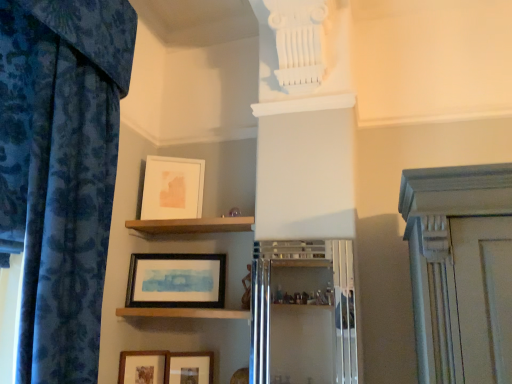
Question: From a real-world perspective, is wooden matte picture frame at lower left, the 4th picture frame when ordered from top to bottom, physically above matte white picture frame at upper center, which is the 1th picture frame from top to bottom?

Choices:
 (A) no
 (B) yes

Answer: (A)

Question: Can you confirm if wooden matte picture frame at lower left, the first picture frame when ordered from bottom to top, is thinner than matte white picture frame at upper center, which is the 1th picture frame from top to bottom?

Choices:
 (A) yes
 (B) no

Answer: (B)

Question: Is wooden matte picture frame at lower left, the first picture frame when ordered from bottom to top, next to matte white picture frame at upper center, which is the 1th picture frame from top to bottom?

Choices:
 (A) yes
 (B) no

Answer: (B)

Question: Is wooden matte picture frame at lower left, the 4th picture frame when ordered from top to bottom, not inside matte white picture frame at upper center, which is the 1th picture frame from top to bottom?

Choices:
 (A) no
 (B) yes

Answer: (B)

Question: Is wooden matte picture frame at lower left, the 4th picture frame when ordered from top to bottom, facing towards matte white picture frame at upper center, the fourth picture frame positioned from the bottom?

Choices:
 (A) no
 (B) yes

Answer: (A)

Question: Is the depth of wooden matte picture frame at lower left, the first picture frame when ordered from bottom to top, less than that of matte white picture frame at upper center, the fourth picture frame positioned from the bottom?

Choices:
 (A) no
 (B) yes

Answer: (B)

Question: Does brown wooden shelf at upper center, which is counted as the 2th shelf, starting from the bottom, have a lesser width compared to wooden framed picture at lower center, acting as the second picture frame starting from the bottom?

Choices:
 (A) no
 (B) yes

Answer: (A)

Question: From a real-world perspective, is brown wooden shelf at upper center, which is counted as the 2th shelf, starting from the bottom, located beneath wooden framed picture at lower center, positioned as the 3th picture frame in top-to-bottom order?

Choices:
 (A) no
 (B) yes

Answer: (A)

Question: Considering the relative sizes of brown wooden shelf at upper center, which is counted as the 2th shelf, starting from the bottom, and wooden framed picture at lower center, positioned as the 3th picture frame in top-to-bottom order, in the image provided, is brown wooden shelf at upper center, which is counted as the 2th shelf, starting from the bottom, wider than wooden framed picture at lower center, positioned as the 3th picture frame in top-to-bottom order,?

Choices:
 (A) yes
 (B) no

Answer: (A)

Question: Does brown wooden shelf at upper center, which is counted as the 2th shelf, starting from the bottom, have a larger size compared to wooden framed picture at lower center, acting as the second picture frame starting from the bottom?

Choices:
 (A) yes
 (B) no

Answer: (A)

Question: Is brown wooden shelf at upper center, which is the first shelf in top-to-bottom order, further to camera compared to wooden framed picture at lower center, acting as the second picture frame starting from the bottom?

Choices:
 (A) yes
 (B) no

Answer: (B)

Question: Considering the relative sizes of brown wooden shelf at upper center, which is counted as the 2th shelf, starting from the bottom, and wooden framed picture at lower center, acting as the second picture frame starting from the bottom, in the image provided, is brown wooden shelf at upper center, which is counted as the 2th shelf, starting from the bottom, shorter than wooden framed picture at lower center, acting as the second picture frame starting from the bottom,?

Choices:
 (A) no
 (B) yes

Answer: (B)

Question: Is black matte picture frame at lower center, which is counted as the 2th picture frame, starting from the top, smaller than wooden matte picture frame at lower left, the first picture frame when ordered from bottom to top?

Choices:
 (A) yes
 (B) no

Answer: (B)